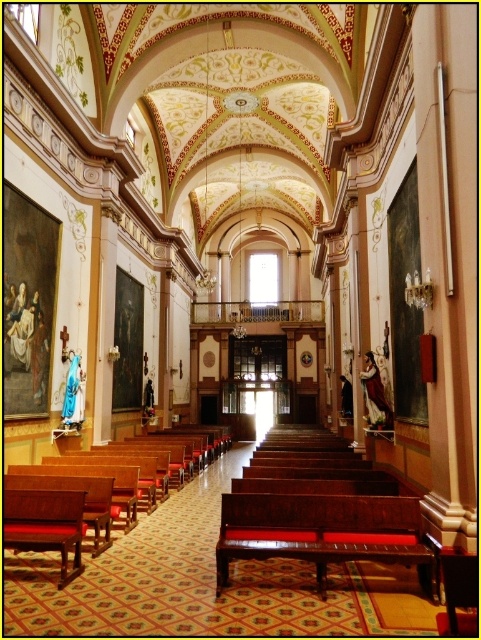
Question: Which object appears closest to the camera in this image?

Choices:
 (A) wooden polished bench at center
 (B) mahogany wood bench at center

Answer: (B)

Question: Does mahogany wood bench at center have a greater width compared to wooden polished bench at center?

Choices:
 (A) no
 (B) yes

Answer: (A)

Question: Which point is closer to the camera?

Choices:
 (A) wooden polished bench at center
 (B) mahogany wood bench at center

Answer: (B)

Question: Is mahogany wood bench at center smaller than wooden polished bench at center?

Choices:
 (A) no
 (B) yes

Answer: (B)

Question: Is mahogany wood bench at center positioned in front of wooden polished bench at center?

Choices:
 (A) no
 (B) yes

Answer: (B)